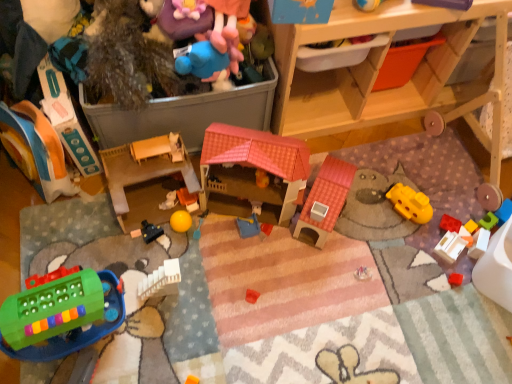
Identify the location of free space that is in between white matte block at lower right, positioned as the second toy in right-to-left order, and blue plastic toy at center, which is the fifth toy from right to left. This screenshot has height=384, width=512. 357,240.